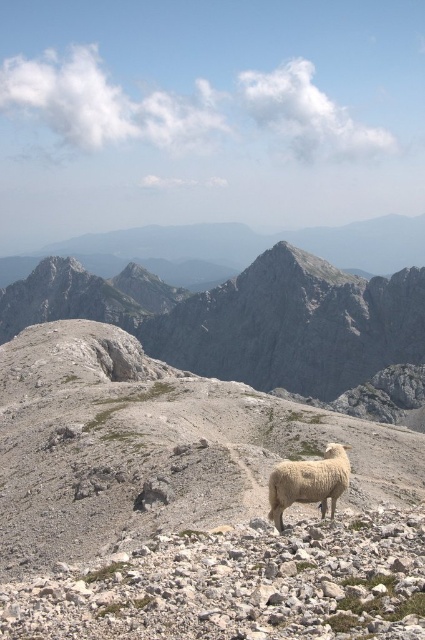
In the scene shown: You are a hiker who wants to take a photo of the gray rocky mountain at center and the white woolly sheep at center. Since you have a camera with a fixed focal length, you need to adjust your position so that both objects appear the same size in the photo. Which object should you move closer to, and which should you move farther away from?

To make both the gray rocky mountain at center and the white woolly sheep at center appear the same size in the photo, you should move closer to the gray rocky mountain at center and move farther away from the white woolly sheep at center. This is because the gray rocky mountain at center is taller than the white woolly sheep at center, so reducing its distance will help balance their apparent sizes.

You are a hiker trying to navigate through the rocky terrain. You see two landmarks marked as point A at coordinates point A at point (393, 288) and point B at point (339, 493). Which point is closer to your current position if you are standing at the base of the mountains?

Point B at point (339, 493) is closer to your current position because it is in front of point A at point (393, 288) according to their spatial arrangement.

From the picture: You are a hiker standing at the base of the gray rocky mountain at center and looking towards the white woolly sheep at center. Which object is higher in elevation?

The gray rocky mountain at center is located above the white woolly sheep at center, so the gray rocky mountain at center is higher in elevation.